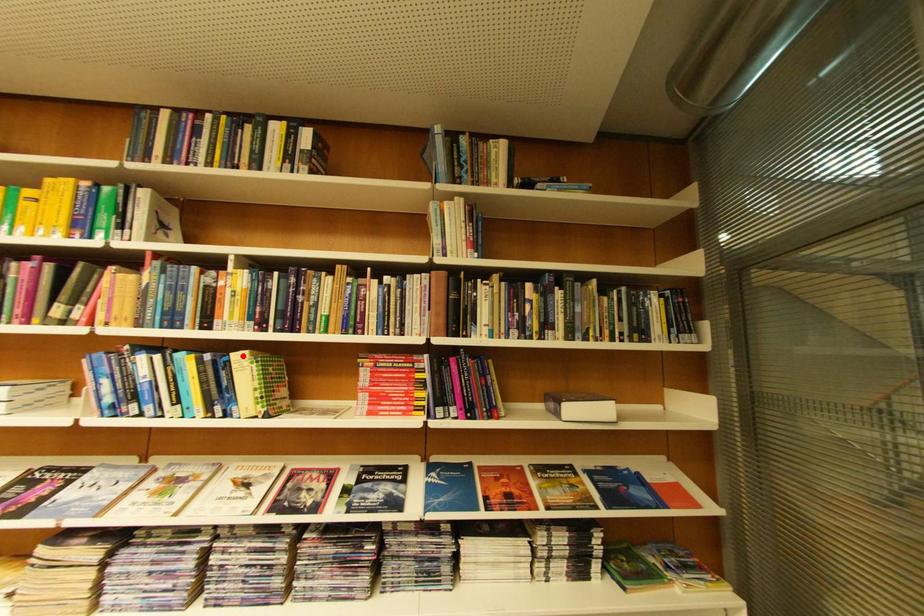
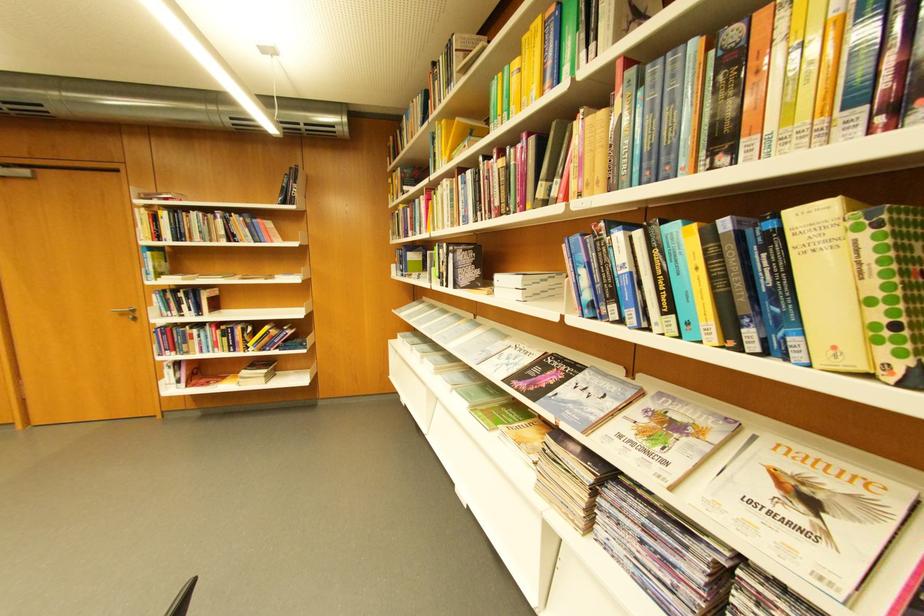
The point at the highlighted location is marked in the first image. Where is the corresponding point in the second image?

(796, 214)